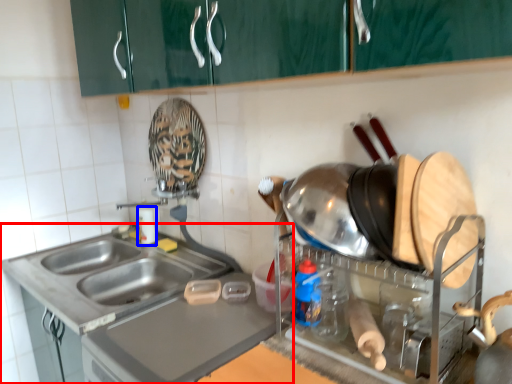
Question: Which object appears closest to the camera in this image, countertop (highlighted by a red box) or bottle (highlighted by a blue box)?

Choices:
 (A) countertop
 (B) bottle

Answer: (A)